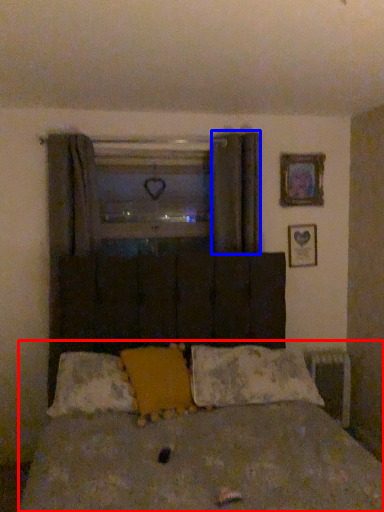
Question: Among these objects, which one is farthest to the camera, bed (highlighted by a red box) or curtain (highlighted by a blue box)?

Choices:
 (A) bed
 (B) curtain

Answer: (B)